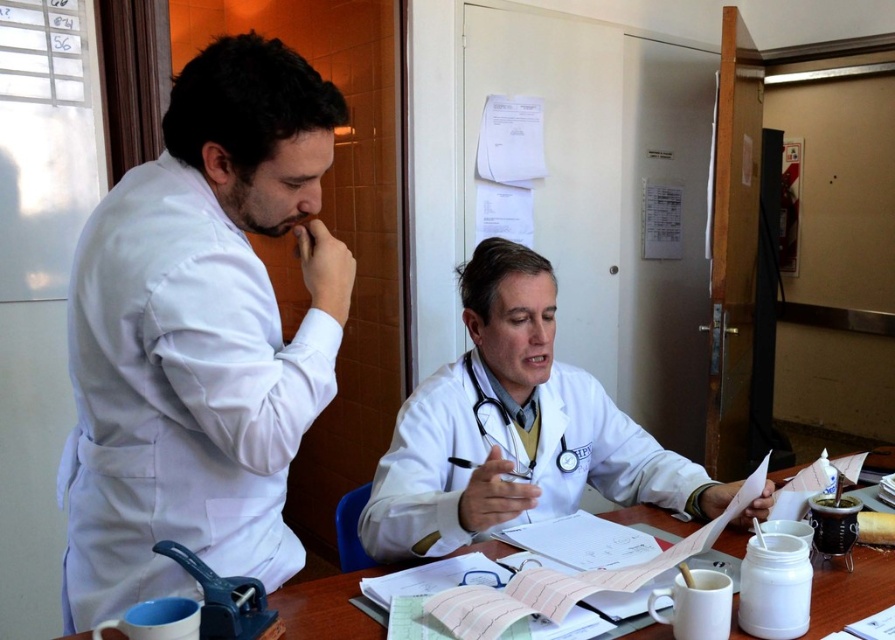
Who is more forward, (x=169, y=531) or (x=879, y=560)?

Point (x=169, y=531)

Which is above, white matte lab coat at left or wooden table at center?

Positioned higher is white matte lab coat at left.

This screenshot has width=895, height=640. What do you see at coordinates (200, 337) in the screenshot?
I see `white matte lab coat at left` at bounding box center [200, 337].

Locate an element on the screen. Image resolution: width=895 pixels, height=640 pixels. white matte lab coat at left is located at coordinates (200, 337).

Which of these two, white matte lab coat at left or white matte coat at center, stands shorter?

With less height is white matte coat at center.

Who is more forward, [307,204] or [467,502]?

Point [307,204] is more forward.

Does point (330, 349) lie in front of point (703, 506)?

That is True.

The height and width of the screenshot is (640, 895). In order to click on white matte lab coat at left in this screenshot , I will do `click(200, 337)`.

Does wooden table at center have a smaller size compared to white rubber stethoscope at center?

Yes, wooden table at center is smaller than white rubber stethoscope at center.

Which of these two, wooden table at center or white rubber stethoscope at center, stands taller?

white rubber stethoscope at center is taller.

Which is behind, point (891, 451) or point (470, 369)?

The point (891, 451) is behind.

Identify the location of wooden table at center. This screenshot has width=895, height=640. (325, 609).